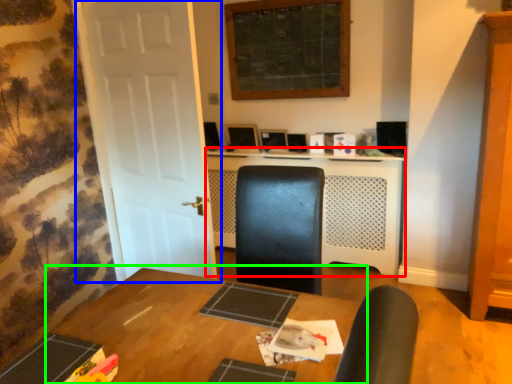
Question: Which object is the closest to the computer desk (highlighted by a red box)? Choose among these: door (highlighted by a blue box) or table (highlighted by a green box).

Choices:
 (A) door
 (B) table

Answer: (A)